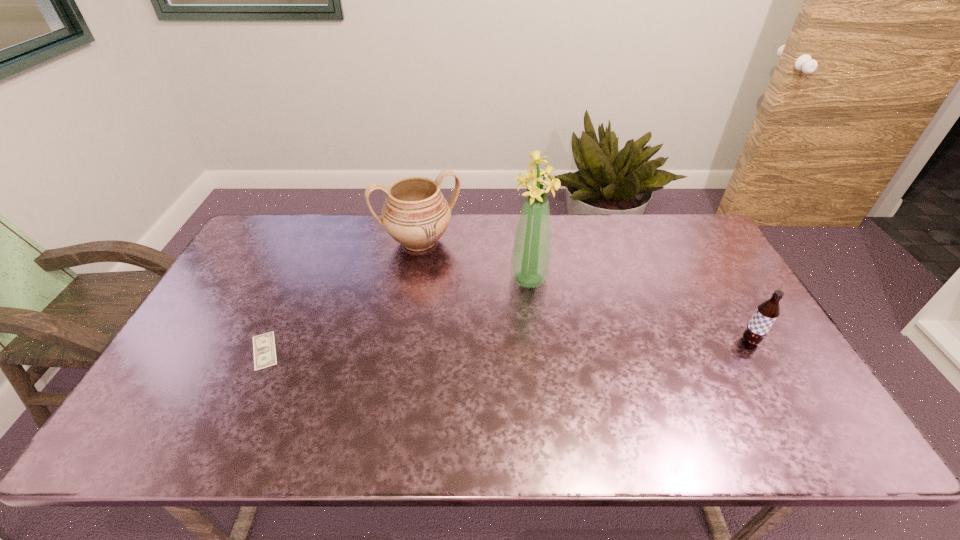
Find the location of a particular element. The image size is (960, 540). vacant space at the left edge of the desktop is located at coordinates (277, 271).

Locate an element on the screen. vacant space at the right edge of the desktop is located at coordinates (731, 330).

In the image, there is a desktop. Where is `free space at the far left corner`? free space at the far left corner is located at coordinates (282, 234).

You are a GUI agent. You are given a task and a screenshot of the screen. Output one action in this format:
    pyautogui.click(x=<x>, y=<y>)
    Task: Click on the vacant space at the far right corner
    Image resolution: width=960 pixels, height=540 pixels.
    Given the screenshot: What is the action you would take?
    pyautogui.click(x=680, y=224)

In the image, there is a desktop. Where is `free space at the near right corner`? This screenshot has height=540, width=960. free space at the near right corner is located at coordinates (766, 386).

The height and width of the screenshot is (540, 960). In order to click on free space between the rightmost object and the farthest object in this screenshot , I will do `click(585, 291)`.

I want to click on free point between the second farthest object and the root beer, so click(639, 310).

The height and width of the screenshot is (540, 960). Identify the location of vacant space that's between the shortest object and the root beer. (507, 346).

Identify the location of free point between the farthest object and the shortest object. The width and height of the screenshot is (960, 540). (342, 296).

The height and width of the screenshot is (540, 960). What are the coordinates of `empty space that is in between the third object from right to left and the root beer` in the screenshot? It's located at (585, 291).